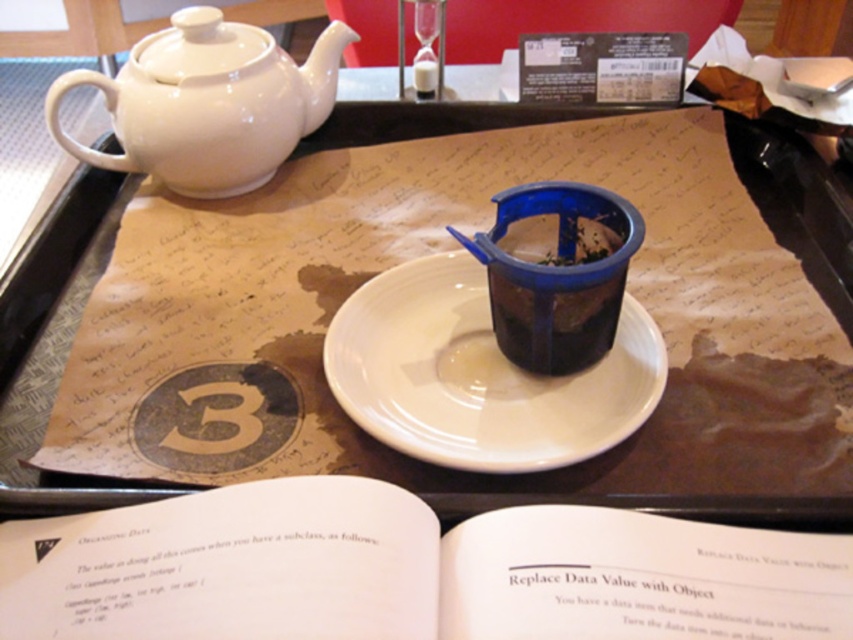
Is white paper book at center to the right of white glossy teapot at upper left from the viewer's perspective?

Indeed, white paper book at center is positioned on the right side of white glossy teapot at upper left.

Is point (490, 515) farther from camera compared to point (148, 125)?

No, (490, 515) is closer to viewer.

Locate an element on the screen. Image resolution: width=853 pixels, height=640 pixels. white paper book at center is located at coordinates (410, 572).

How much distance is there between white paper book at center and matte plastic cup at center?

4.95 inches

Who is more forward, (726, 611) or (688, 506)?

Point (726, 611) is in front.

The width and height of the screenshot is (853, 640). I want to click on white paper book at center, so click(x=410, y=572).

In the scene shown: Is white ceramic saucer at center further to the viewer compared to white glossy teapot at upper left?

No.

How distant is white ceramic saucer at center from white glossy teapot at upper left?

white ceramic saucer at center is 10.85 inches from white glossy teapot at upper left.

The height and width of the screenshot is (640, 853). In order to click on white ceramic saucer at center in this screenshot , I will do (x=479, y=376).

Image resolution: width=853 pixels, height=640 pixels. What are the coordinates of `white ceramic saucer at center` in the screenshot? It's located at (479, 376).